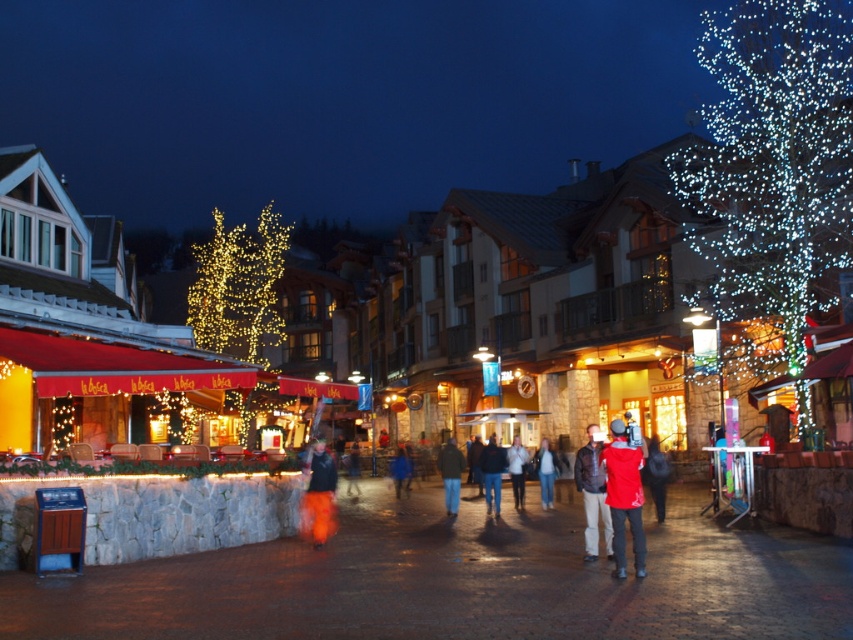
Question: Is white cotton jacket at center to the left of red jacket at center from the viewer's perspective?

Choices:
 (A) yes
 (B) no

Answer: (B)

Question: Estimate the real-world distances between objects in this image. Which object is closer to the white cotton jacket at center?

Choices:
 (A) dark brown leather jacket at center
 (B) dark blue jeans at center
 (C) red fabric jacket at center

Answer: (B)

Question: Does dark gray jacket at center have a smaller size compared to red jacket at center?

Choices:
 (A) yes
 (B) no

Answer: (B)

Question: Which object is farther from the camera taking this photo?

Choices:
 (A) dark brown leather jacket at center
 (B) dark blue jeans at center
 (C) orange fabric pants at center

Answer: (B)

Question: Which is farther from the dark brown leather jacket at center?

Choices:
 (A) dark blue jeans at center
 (B) dark gray jacket at center
 (C) orange fabric pants at center

Answer: (C)

Question: Does red fabric jacket at center have a larger size compared to dark gray jacket at center?

Choices:
 (A) yes
 (B) no

Answer: (B)